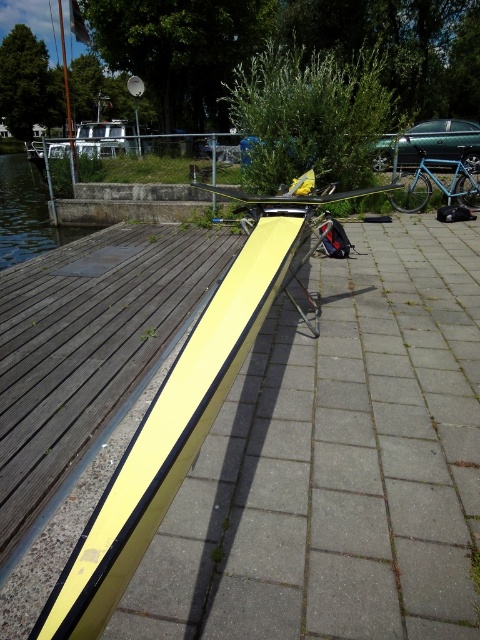
You are standing on the wooden dock and want to cross to the other side. There is a transparent water at dock left and a blue metallic bicycle at right. Which object should you avoid stepping on to reach the other side safely?

You should avoid stepping on the transparent water at dock left because it is bigger than the blue metallic bicycle at right and likely deeper, making it unsafe to walk across.

You are standing on the wooden dock and want to place a small potted plant exactly at the position of the transparent water at dock left. According to the scene description, is this possible?

The transparent water at dock left is located at point [26,212], which is over water. Since the potted plant cannot be placed in water, you cannot place it there.

You are planning to place a new bench in the riverside area. The bench is 1.2 meters wide. You have two options for placement locations based on the image. One is near the transparent water at dock left, and the other is near the blue metallic bicycle at right. Which location would allow the bench to fit better without overlapping other objects?

The transparent water at dock left has a larger width than the blue metallic bicycle at right, so placing the bench near the transparent water at dock left would provide more space and allow it to fit better without overlapping other objects.